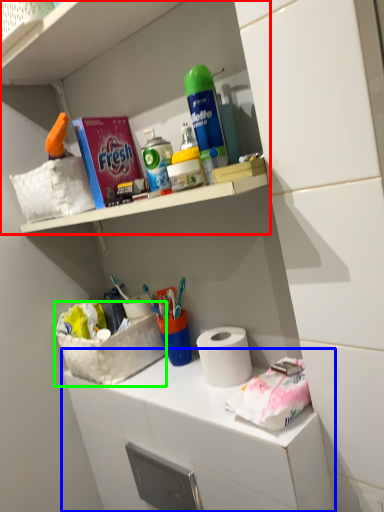
Question: Considering the real-world distances, which object is farthest from shelf (highlighted by a red box)? counter (highlighted by a blue box) or basket (highlighted by a green box)?

Choices:
 (A) counter
 (B) basket

Answer: (A)